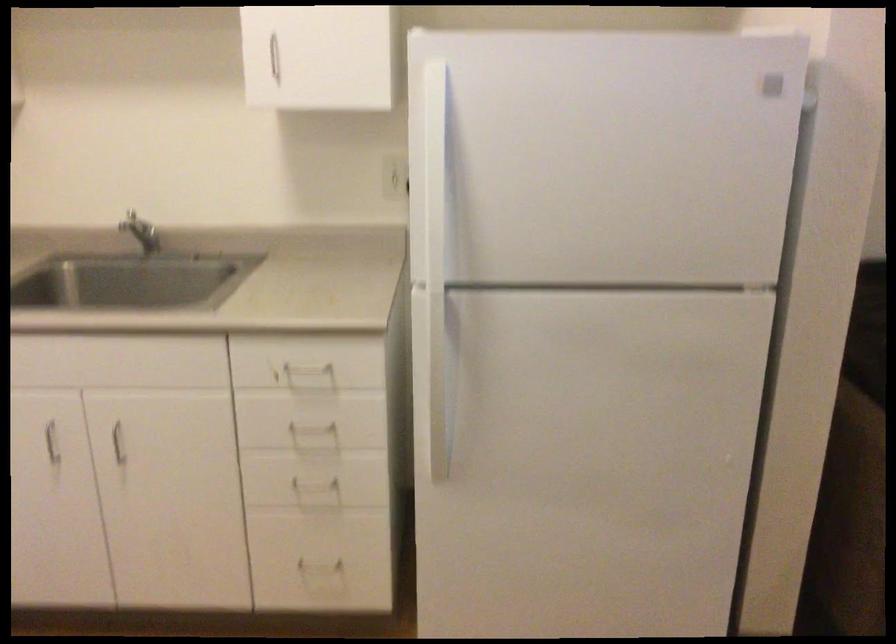
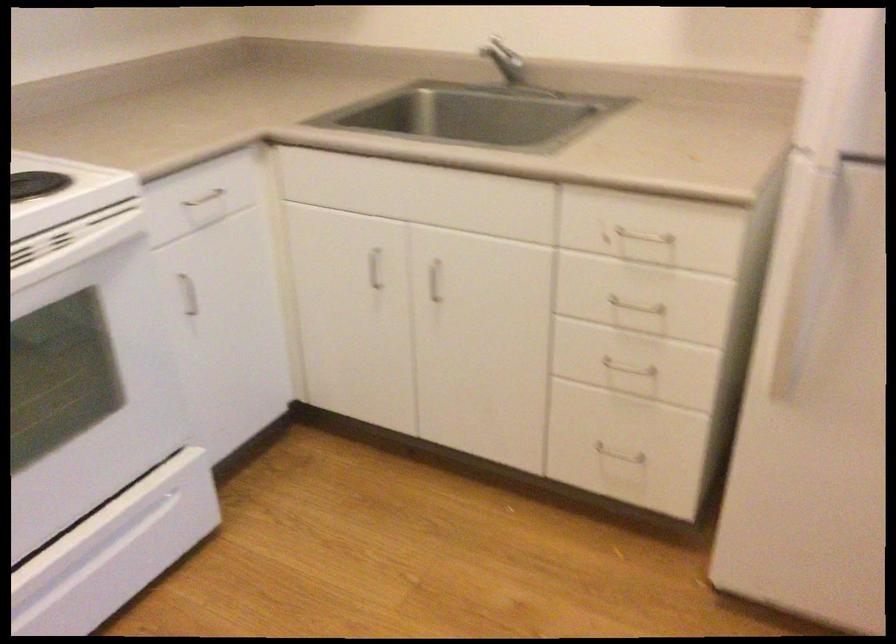
Question: Based on the continuous images, in which direction is the camera rotating? Reply with the corresponding letter.

Choices:
 (A) Left
 (B) Right
 (C) Up
 (D) Down

Answer: (A)